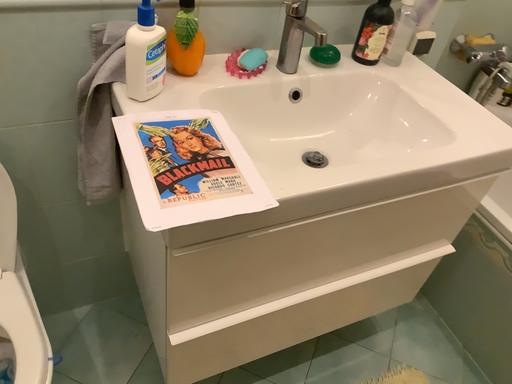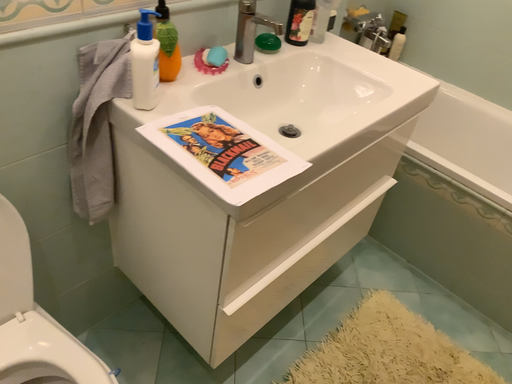
Question: Which way did the camera rotate in the video?

Choices:
 (A) rotated right
 (B) rotated left

Answer: (A)